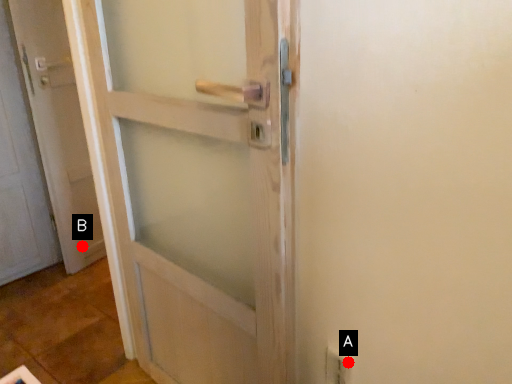
Question: Two points are circled on the image, labeled by A and B beside each circle. Which point is farther from the camera taking this photo?

Choices:
 (A) A is further
 (B) B is further

Answer: (B)